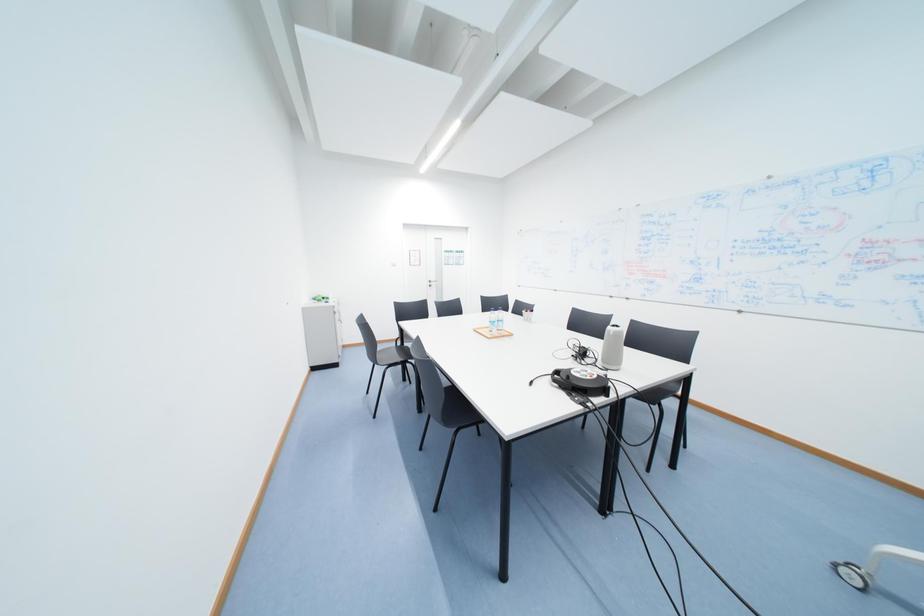
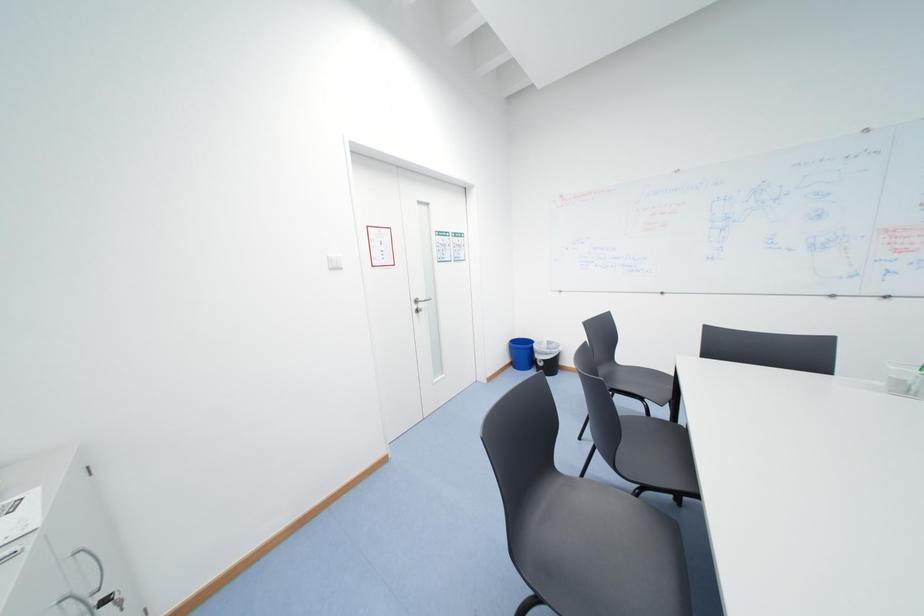
Which direction would the cameraman need to move to produce the second image?

The cameraman moved toward left, forward.